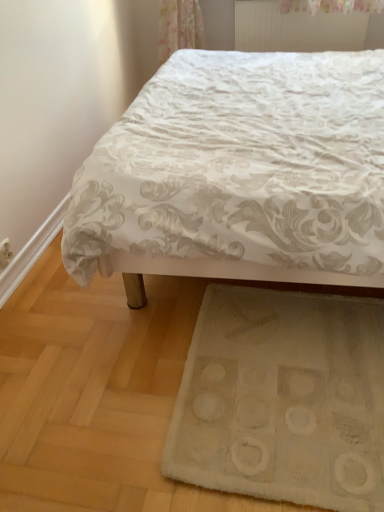
You are a GUI agent. You are given a task and a screenshot of the screen. Output one action in this format:
    pyautogui.click(x=<x>, y=<y>)
    Task: Click on the free space to the left of white soft rug at lower center
    
    Given the screenshot: What is the action you would take?
    pyautogui.click(x=103, y=372)